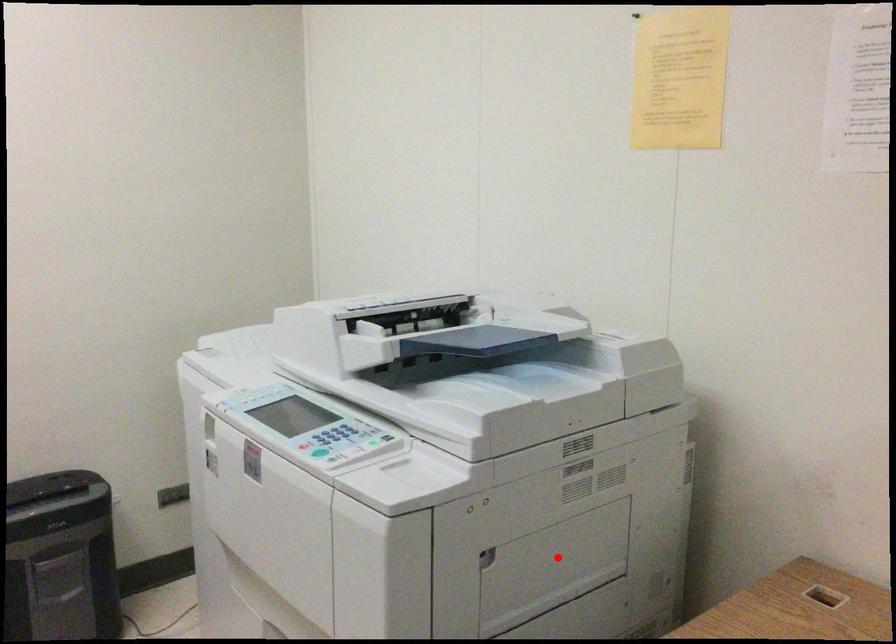
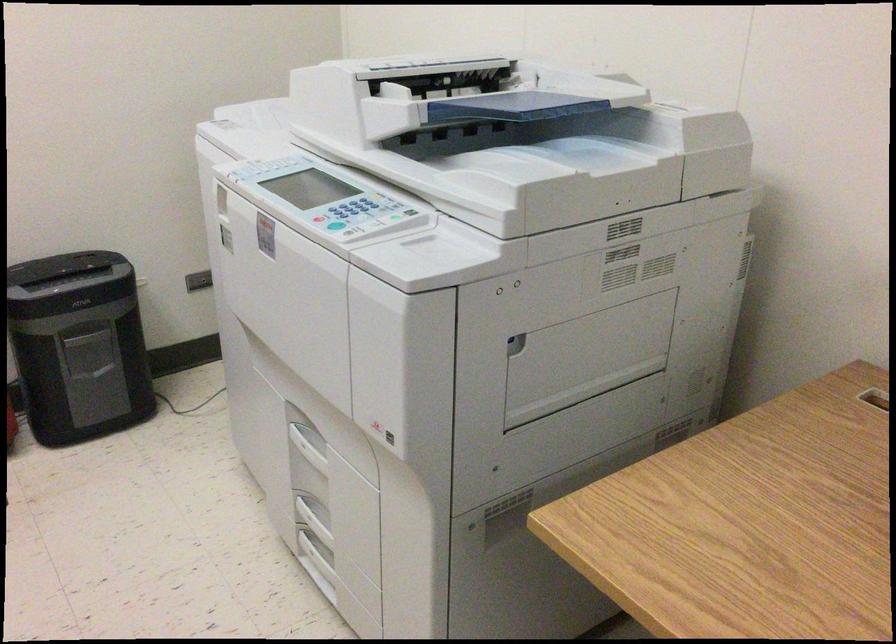
Where in the second image is the point corresponding to the highlighted location from the first image?

(589, 348)